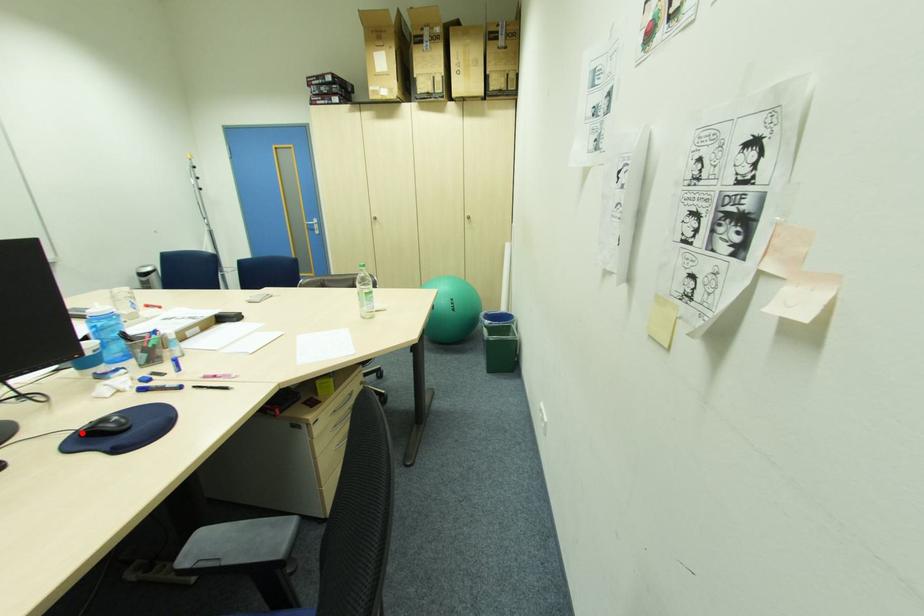
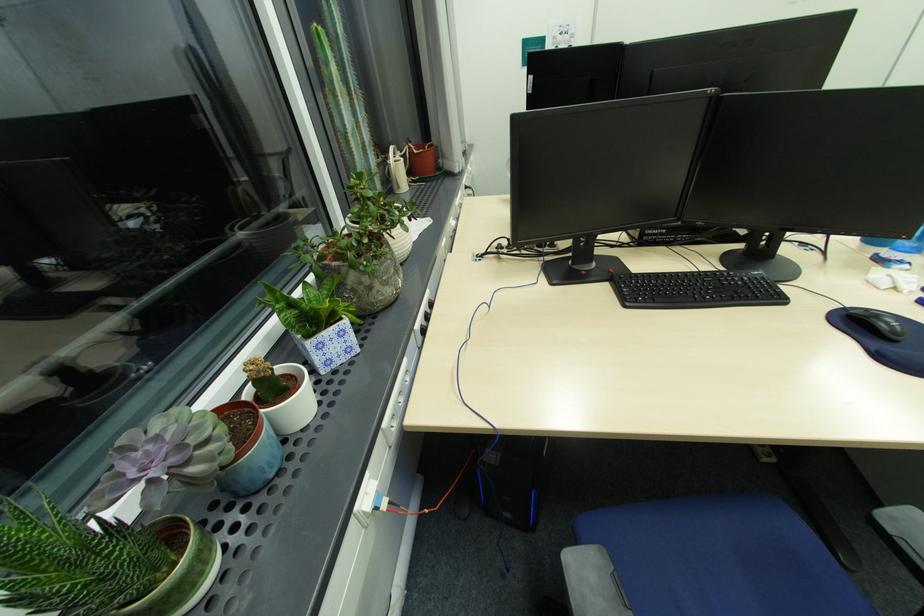
In the second image, find the point that corresponds to the highlighted location in the first image.

(849, 310)